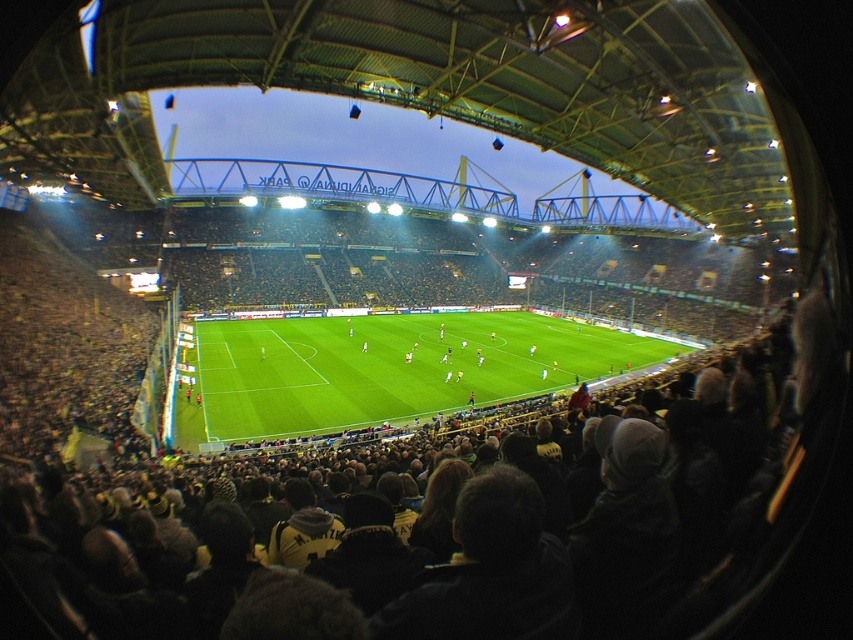
In the scene shown: Can you confirm if black fabric crowd at center is smaller than green grass football field at center?

Yes.

Describe the element at coordinates (434, 531) in the screenshot. I see `black fabric crowd at center` at that location.

Where is `black fabric crowd at center`? black fabric crowd at center is located at coordinates (434, 531).